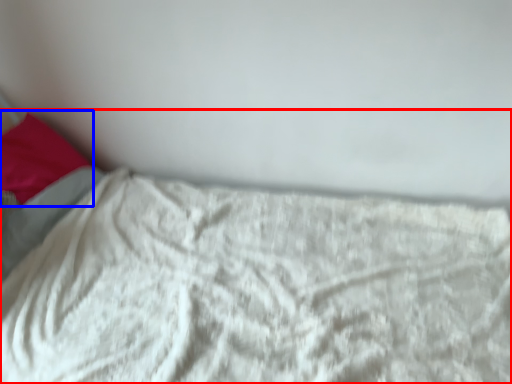
Question: Which object appears farthest to the camera in this image, bed (highlighted by a red box) or pillow (highlighted by a blue box)?

Choices:
 (A) bed
 (B) pillow

Answer: (B)